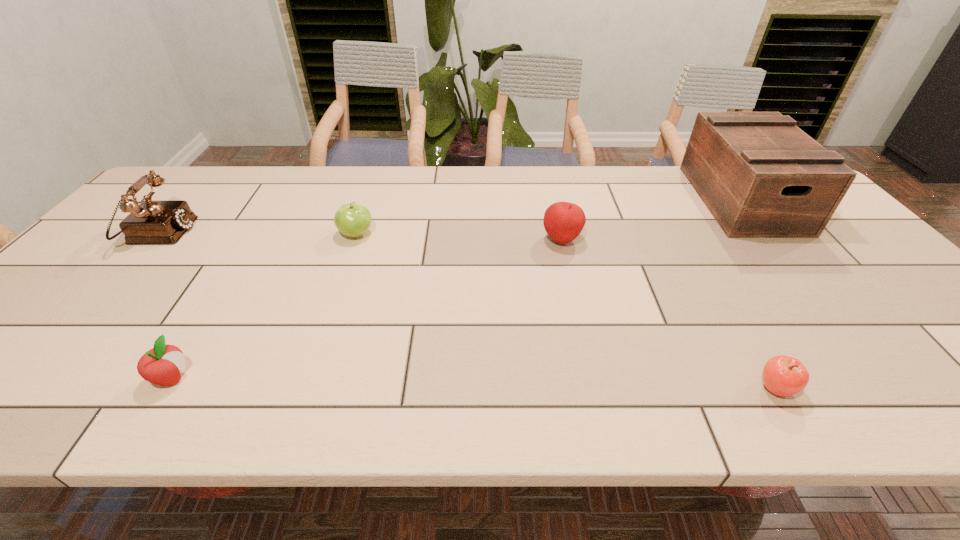
Image resolution: width=960 pixels, height=540 pixels. Find the location of `vacant region that satisfies the following two spatial constraints: 1. on the dial of the telephone; 2. on the back side of the fifth object from left to right`. vacant region that satisfies the following two spatial constraints: 1. on the dial of the telephone; 2. on the back side of the fifth object from left to right is located at coordinates (16, 388).

The width and height of the screenshot is (960, 540). I want to click on free location that satisfies the following two spatial constraints: 1. on the dial of the telephone; 2. on the back side of the fifth object from left to right, so click(x=16, y=388).